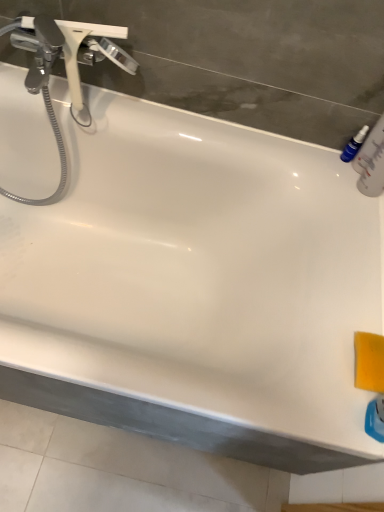
Question: From the image's perspective, is chrome metallic faucet at upper left on blue plastic bottle at upper right?

Choices:
 (A) no
 (B) yes

Answer: (B)

Question: Is chrome metallic faucet at upper left wider than blue plastic bottle at upper right?

Choices:
 (A) yes
 (B) no

Answer: (A)

Question: Is chrome metallic faucet at upper left looking in the opposite direction of blue plastic bottle at upper right?

Choices:
 (A) yes
 (B) no

Answer: (B)

Question: Is chrome metallic faucet at upper left outside of blue plastic bottle at upper right?

Choices:
 (A) no
 (B) yes

Answer: (B)

Question: Does chrome metallic faucet at upper left appear on the right side of blue plastic bottle at upper right?

Choices:
 (A) yes
 (B) no

Answer: (B)

Question: Considering the relative sizes of chrome metallic faucet at upper left and blue plastic bottle at upper right in the image provided, is chrome metallic faucet at upper left taller than blue plastic bottle at upper right?

Choices:
 (A) yes
 (B) no

Answer: (A)

Question: Considering the relative positions of blue plastic bottle at upper right and chrome metallic faucet at upper left in the image provided, is blue plastic bottle at upper right to the left of chrome metallic faucet at upper left from the viewer's perspective?

Choices:
 (A) yes
 (B) no

Answer: (B)

Question: Is blue plastic bottle at upper right outside of chrome metallic faucet at upper left?

Choices:
 (A) no
 (B) yes

Answer: (B)

Question: Is blue plastic bottle at upper right looking in the opposite direction of chrome metallic faucet at upper left?

Choices:
 (A) no
 (B) yes

Answer: (A)

Question: Considering the relative positions of blue plastic bottle at upper right and chrome metallic faucet at upper left in the image provided, is blue plastic bottle at upper right to the right of chrome metallic faucet at upper left from the viewer's perspective?

Choices:
 (A) yes
 (B) no

Answer: (A)

Question: From a real-world perspective, is blue plastic bottle at upper right beneath chrome metallic faucet at upper left?

Choices:
 (A) yes
 (B) no

Answer: (A)

Question: Considering the relative sizes of blue plastic bottle at upper right and chrome metallic faucet at upper left in the image provided, is blue plastic bottle at upper right wider than chrome metallic faucet at upper left?

Choices:
 (A) yes
 (B) no

Answer: (B)

Question: Based on their sizes in the image, would you say blue plastic bottle at upper right is bigger or smaller than chrome metallic faucet at upper left?

Choices:
 (A) big
 (B) small

Answer: (B)